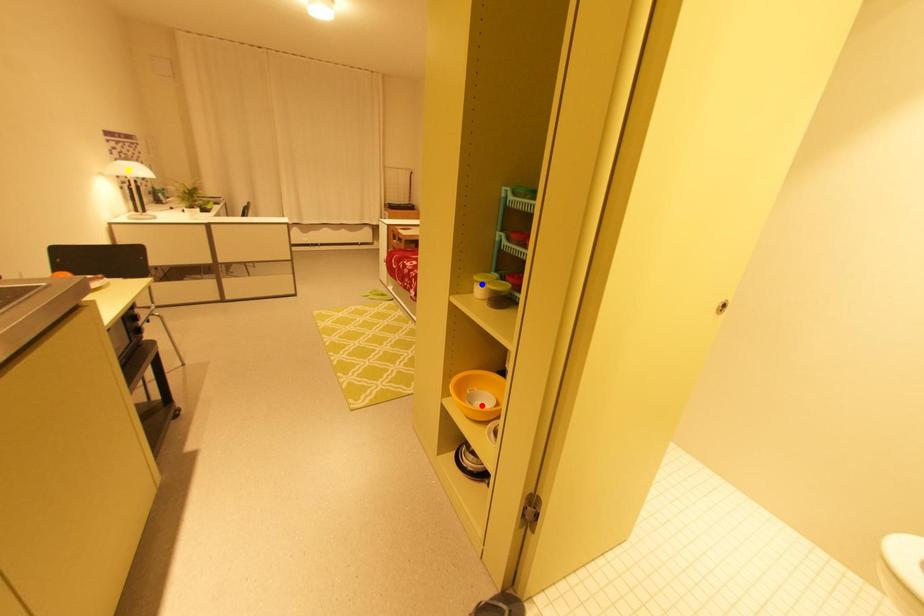
Order these from nearest to farthest:
yellow point | blue point | red point

blue point → red point → yellow point